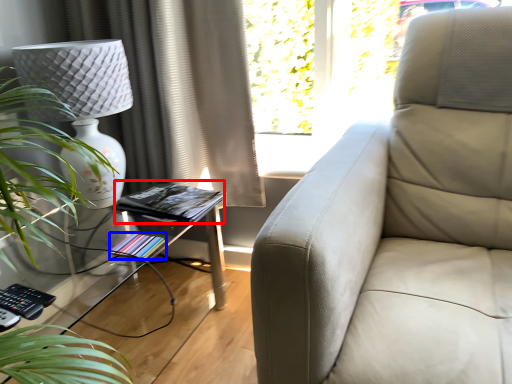
Question: Which object is further to the camera taking this photo, book (highlighted by a red box) or book (highlighted by a blue box)?

Choices:
 (A) book
 (B) book

Answer: (A)